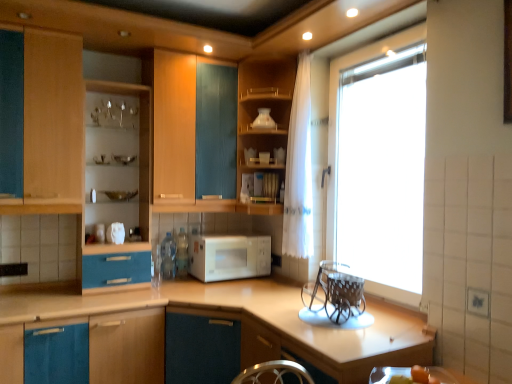
You are a GUI agent. You are given a task and a screenshot of the screen. Output one action in this format:
    pyautogui.click(x=<x>, y=<y>)
    Task: Click on the empty space that is ontop of matte wood shelves at center, acting as the second cabinetry starting from the left (from a real-world perspective)
    This screenshot has height=384, width=512.
    Given the screenshot: What is the action you would take?
    pyautogui.click(x=112, y=89)